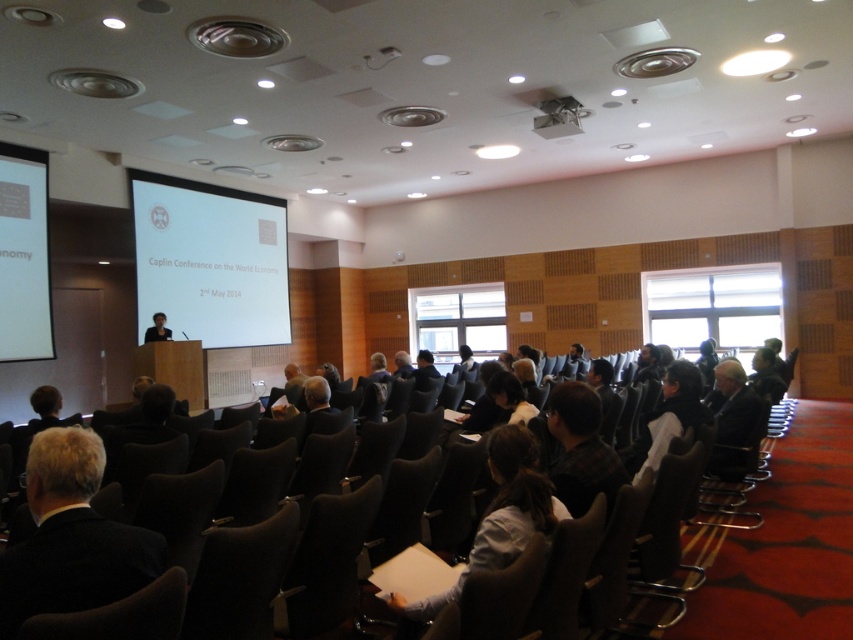
Does gray fabric suit at lower left appear over black fabric person at center?

No.

Which is behind, point (86, 560) or point (169, 339)?

Positioned behind is point (169, 339).

In order to click on gray fabric suit at lower left in this screenshot , I will do `click(71, 538)`.

Is white glossy projector screen at center to the left of light blue shirt at center from the viewer's perspective?

Indeed, white glossy projector screen at center is positioned on the left side of light blue shirt at center.

This screenshot has width=853, height=640. Identify the location of white glossy projector screen at center. (210, 260).

Locate an element on the screen. Image resolution: width=853 pixels, height=640 pixels. black leather chair at center is located at coordinates (120, 616).

In the scene shown: Is black leather chair at center closer to camera compared to white glossy projector screen at left?

That is True.

Find the location of `black leather chair at center`. black leather chair at center is located at coordinates (120, 616).